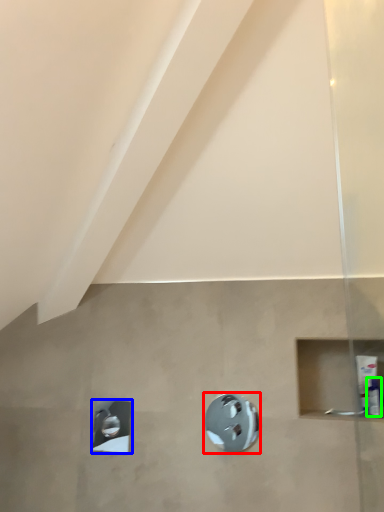
Question: Which object is positioned farthest from shower (highlighted by a red box)? Select from shower (highlighted by a blue box) and toiletry (highlighted by a green box).

Choices:
 (A) shower
 (B) toiletry

Answer: (B)